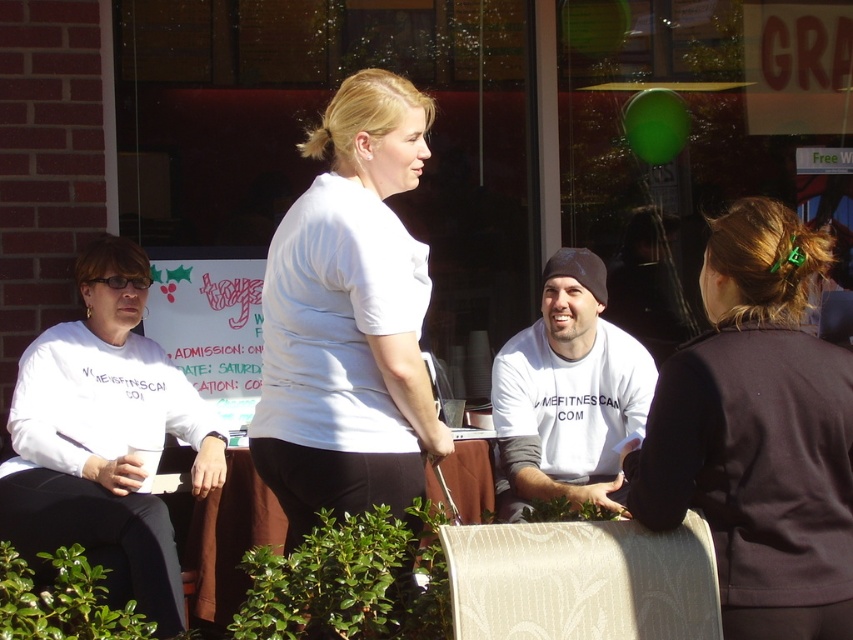
Looking at this image, you are a photographer positioned in front of the scene. You need to capture a clear photo of both the white matte shirt at center and the black fabric chair at lower left. Which object will appear larger in the photo?

The white matte shirt at center will appear larger in the photo because it is closer to the viewer than the black fabric chair at lower left.